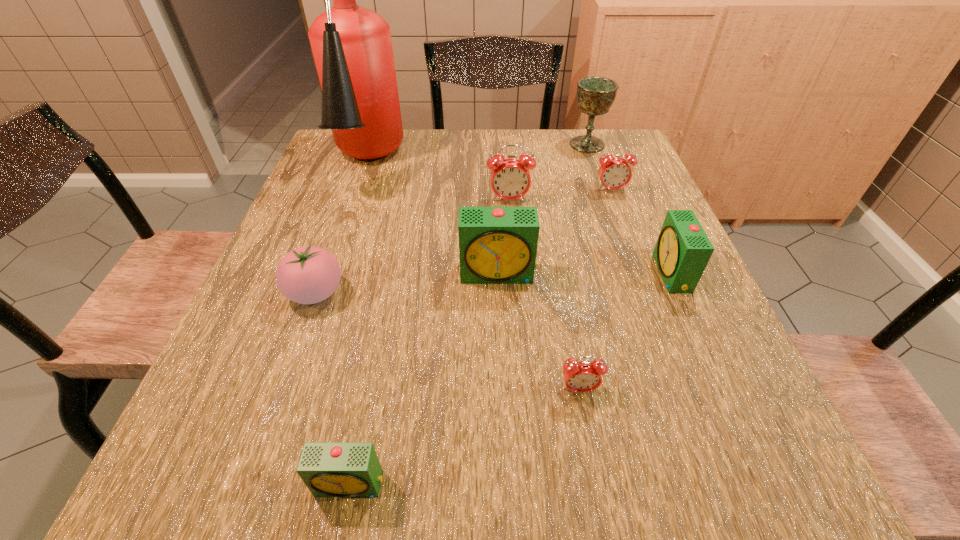
This screenshot has height=540, width=960. Find the location of `free space between the rightmost red alarm clock and the second green alarm clock from right to left`. free space between the rightmost red alarm clock and the second green alarm clock from right to left is located at coordinates (555, 232).

Identify the location of vacant area between the rightmost green alarm clock and the second green alarm clock from left to right. This screenshot has width=960, height=540. (585, 274).

This screenshot has width=960, height=540. Identify the location of free space between the biggest red alarm clock and the red tomato. (413, 247).

You are a GUI agent. You are given a task and a screenshot of the screen. Output one action in this format:
    pyautogui.click(x=<x>, y=<y>)
    Task: Click on the unoccupied area between the red tomato and the leftmost alarm clock
    
    Given the screenshot: What is the action you would take?
    pyautogui.click(x=333, y=388)

Image resolution: width=960 pixels, height=540 pixels. In order to click on free spot between the chalice and the leftmost alarm clock in this screenshot , I will do `click(468, 314)`.

Point out which object is positioned as the second nearest to the fifth nearest alarm clock. Please provide its 2D coordinates. Your answer should be formatted as a tuple, i.e. [(x, y)], where the tuple contains the x and y coordinates of a point satisfying the conditions above.

[(497, 245)]

You are a GUI agent. You are given a task and a screenshot of the screen. Output one action in this format:
    pyautogui.click(x=<x>, y=<y>)
    Task: Click on the object that is the eighth closest one to the nearest alarm clock
    Image resolution: width=960 pixels, height=540 pixels.
    Given the screenshot: What is the action you would take?
    pyautogui.click(x=595, y=95)

Point out which alarm clock is positioned as the fifth nearest to the smallest red alarm clock. Please provide its 2D coordinates. Your answer should be formatted as a tuple, i.e. [(x, y)], where the tuple contains the x and y coordinates of a point satisfying the conditions above.

[(614, 173)]

Find the location of a particular element. The width and height of the screenshot is (960, 540). the third closest alarm clock relative to the red tomato is located at coordinates click(510, 178).

Locate an element on the screen. red alarm clock identified as the closest to the red tomato is located at coordinates (510, 178).